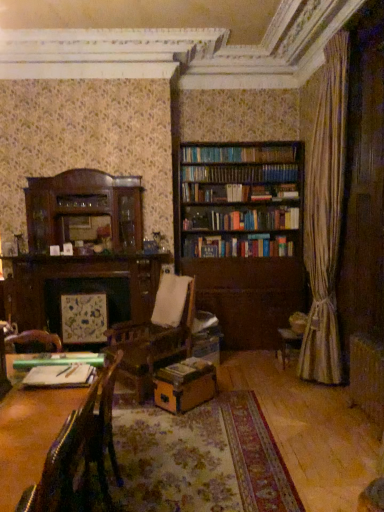
Question: Is wooden book at center, which is the first book from right to left, located within leather cushioned chair at lower left, which ranks as the first chair in front-to-back order?

Choices:
 (A) yes
 (B) no

Answer: (B)

Question: Is leather cushioned chair at lower left, the second chair in the back-to-front sequence, closer to the viewer compared to wooden book at center, which ranks as the 2th book in front-to-back order?

Choices:
 (A) no
 (B) yes

Answer: (B)

Question: Is leather cushioned chair at lower left, the second chair in the back-to-front sequence, smaller than wooden book at center, which is the first book in bottom-to-top order?

Choices:
 (A) yes
 (B) no

Answer: (B)

Question: Is leather cushioned chair at lower left, the second chair in the back-to-front sequence, completely or partially outside of wooden book at center, which is the first book in bottom-to-top order?

Choices:
 (A) no
 (B) yes

Answer: (B)

Question: Considering the relative sizes of leather cushioned chair at lower left, the second chair in the back-to-front sequence, and wooden book at center, the 2th book when ordered from top to bottom, in the image provided, is leather cushioned chair at lower left, the second chair in the back-to-front sequence, taller than wooden book at center, the 2th book when ordered from top to bottom,?

Choices:
 (A) no
 (B) yes

Answer: (B)

Question: Is leather-like dark brown chair at lower left, which is the 2th chair from front to back, in front of or behind green matte ruler at lower left, marked as the 1th book in a left-to-right arrangement, in the image?

Choices:
 (A) behind
 (B) front

Answer: (B)

Question: From a real-world perspective, is leather-like dark brown chair at lower left, which is the 2th chair from front to back, positioned above or below green matte ruler at lower left, which is the second book in right-to-left order?

Choices:
 (A) below
 (B) above

Answer: (A)

Question: Is leather-like dark brown chair at lower left, the first chair positioned from the back, wider or thinner than green matte ruler at lower left, positioned as the first book in top-to-bottom order?

Choices:
 (A) thin
 (B) wide

Answer: (B)

Question: From their relative heights in the image, would you say leather-like dark brown chair at lower left, the first chair positioned from the back, is taller or shorter than green matte ruler at lower left, which is the 2th book from back to front?

Choices:
 (A) tall
 (B) short

Answer: (A)

Question: Is leather cushioned chair at lower left, the second chair in the back-to-front sequence, taller or shorter than green matte ruler at lower left, the first book from the front?

Choices:
 (A) tall
 (B) short

Answer: (A)

Question: From a real-world perspective, relative to green matte ruler at lower left, positioned as the first book in top-to-bottom order, is leather cushioned chair at lower left, which ranks as the first chair in front-to-back order, vertically above or below?

Choices:
 (A) below
 (B) above

Answer: (A)

Question: Would you say leather cushioned chair at lower left, the second chair in the back-to-front sequence, is to the left or to the right of green matte ruler at lower left, marked as the 1th book in a left-to-right arrangement, in the picture?

Choices:
 (A) left
 (B) right

Answer: (B)

Question: Do you think leather cushioned chair at lower left, which ranks as the first chair in front-to-back order, is within green matte ruler at lower left, which is the second book in right-to-left order, or outside of it?

Choices:
 (A) outside
 (B) inside

Answer: (A)

Question: Is green matte ruler at lower left, the first book from the front, taller or shorter than leather cushioned chair at lower left, which ranks as the first chair in front-to-back order?

Choices:
 (A) short
 (B) tall

Answer: (A)

Question: Is green matte ruler at lower left, which is the 2th book from back to front, inside the boundaries of leather cushioned chair at lower left, which ranks as the first chair in front-to-back order, or outside?

Choices:
 (A) inside
 (B) outside

Answer: (B)